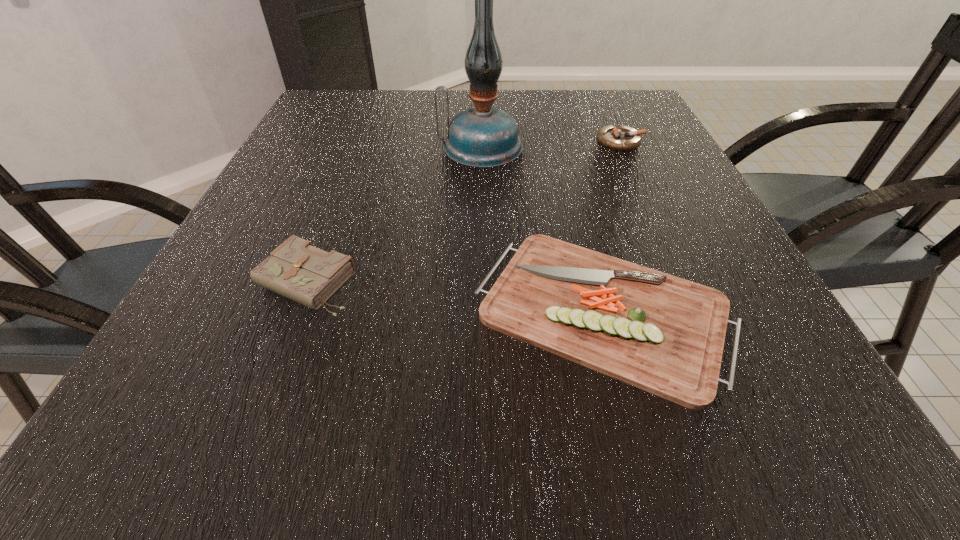
Locate an element on the screen. The width and height of the screenshot is (960, 540). free space between the chopping board and the leftmost object is located at coordinates (455, 295).

You are a GUI agent. You are given a task and a screenshot of the screen. Output one action in this format:
    pyautogui.click(x=<x>, y=<y>)
    Task: Click on the free space between the chopping board and the leftmost object
    This screenshot has height=540, width=960.
    Given the screenshot: What is the action you would take?
    pyautogui.click(x=455, y=295)

Image resolution: width=960 pixels, height=540 pixels. What are the coordinates of `empty space between the tallest object and the ashtray` in the screenshot? It's located at (550, 144).

The height and width of the screenshot is (540, 960). In order to click on free space between the chopping board and the ashtray in this screenshot , I will do `click(612, 225)`.

Image resolution: width=960 pixels, height=540 pixels. In order to click on free point between the oil lamp and the ashtray in this screenshot , I will do `click(550, 144)`.

Identify the location of vacant area that lies between the chopping board and the ashtray. The image size is (960, 540). (612, 225).

This screenshot has width=960, height=540. What are the coordinates of `blank region between the chopping board and the ashtray` in the screenshot? It's located at (612, 225).

You are a GUI agent. You are given a task and a screenshot of the screen. Output one action in this format:
    pyautogui.click(x=<x>, y=<y>)
    Task: Click on the empty space between the oil lamp and the ashtray
    
    Given the screenshot: What is the action you would take?
    pyautogui.click(x=550, y=144)

Where is `vacant area that lies between the ashtray and the diary`? The height and width of the screenshot is (540, 960). vacant area that lies between the ashtray and the diary is located at coordinates (464, 211).

The image size is (960, 540). I want to click on object that stands as the second closest to the diary, so click(482, 137).